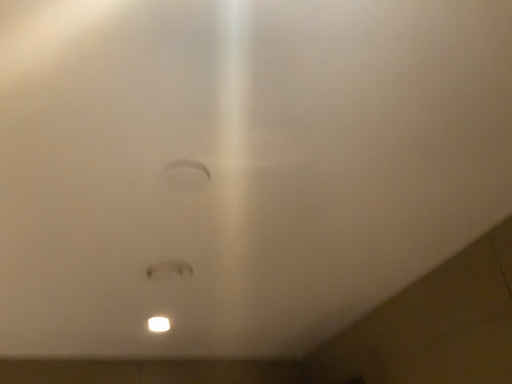
This screenshot has height=384, width=512. Describe the element at coordinates (158, 324) in the screenshot. I see `white glossy lamp at lower center` at that location.

Identify the location of white glossy lamp at lower center. The image size is (512, 384). (x=158, y=324).

Where is `white glossy lamp at lower center`? The height and width of the screenshot is (384, 512). white glossy lamp at lower center is located at coordinates (158, 324).